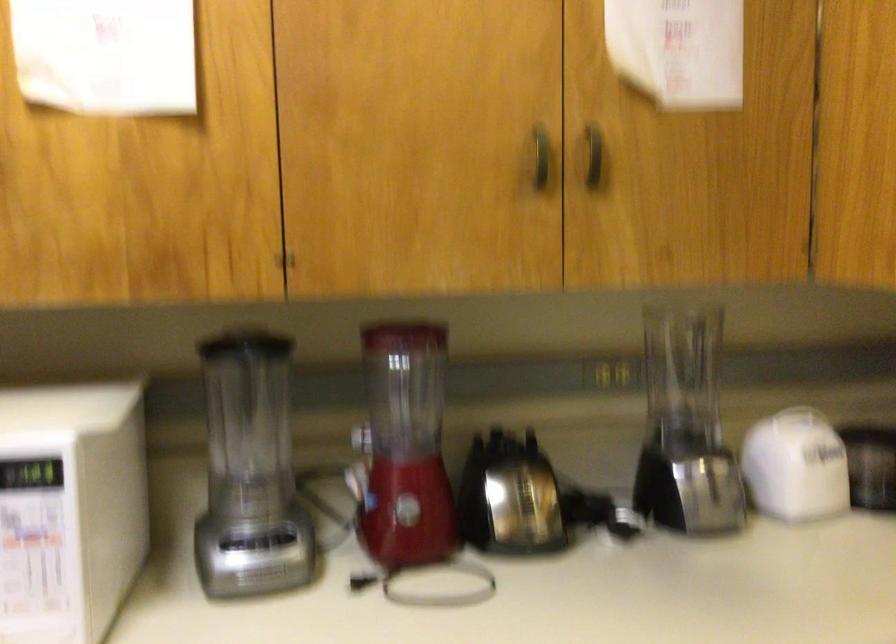
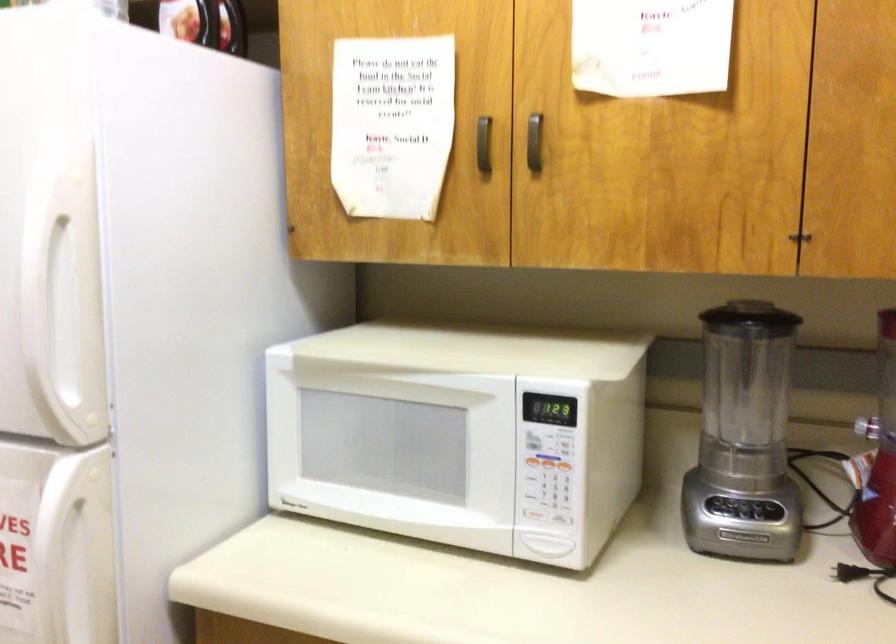
Locate, in the second image, the point that corresponds to (x=259, y=573) in the first image.

(743, 536)